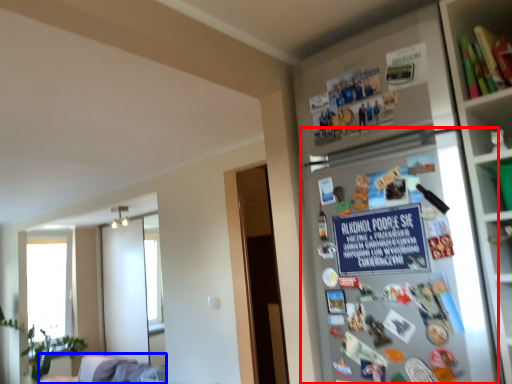
Question: Which point is closer to the camera, fridge (highlighted by a red box) or furniture (highlighted by a blue box)?

Choices:
 (A) fridge
 (B) furniture

Answer: (A)